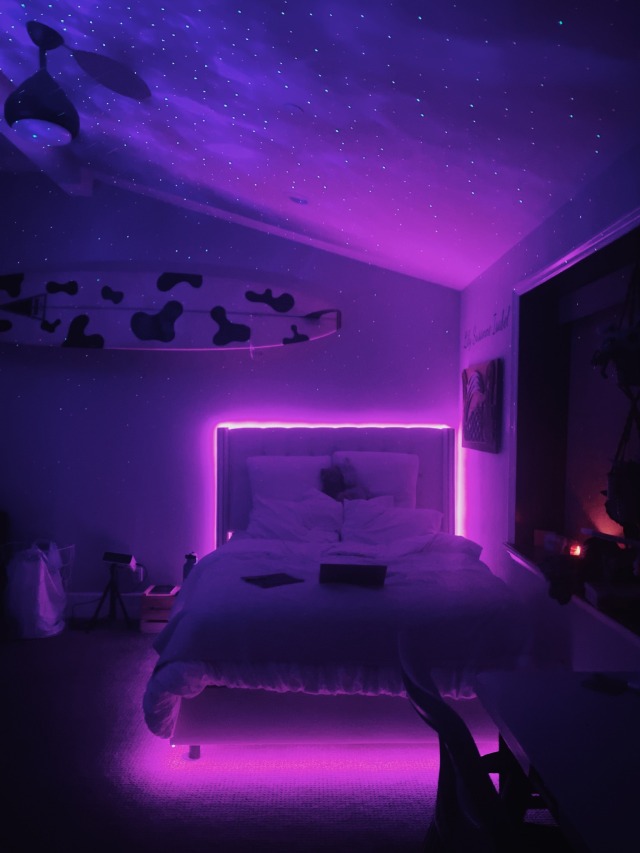
This screenshot has width=640, height=853. What are the coordinates of `bed headboard` in the screenshot? It's located at (377, 438).